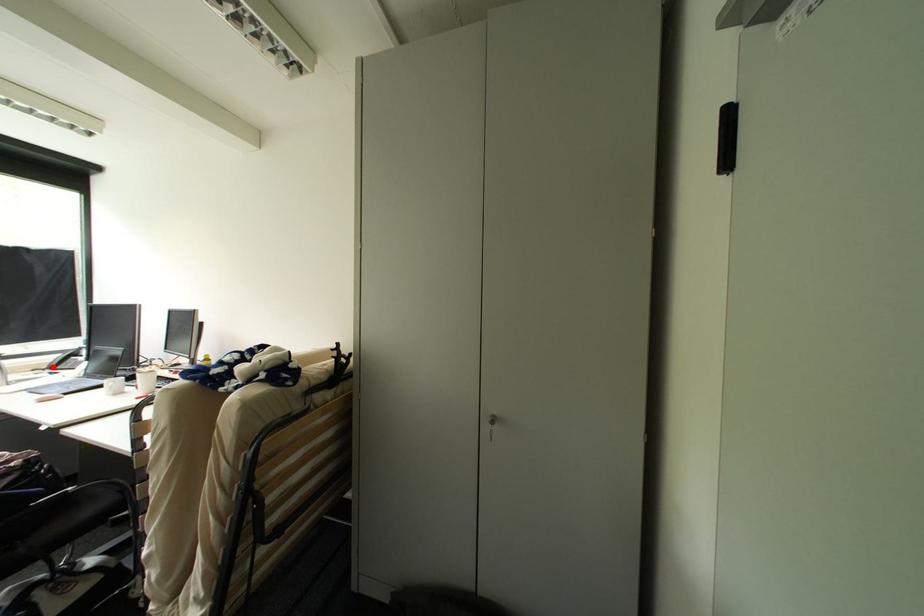
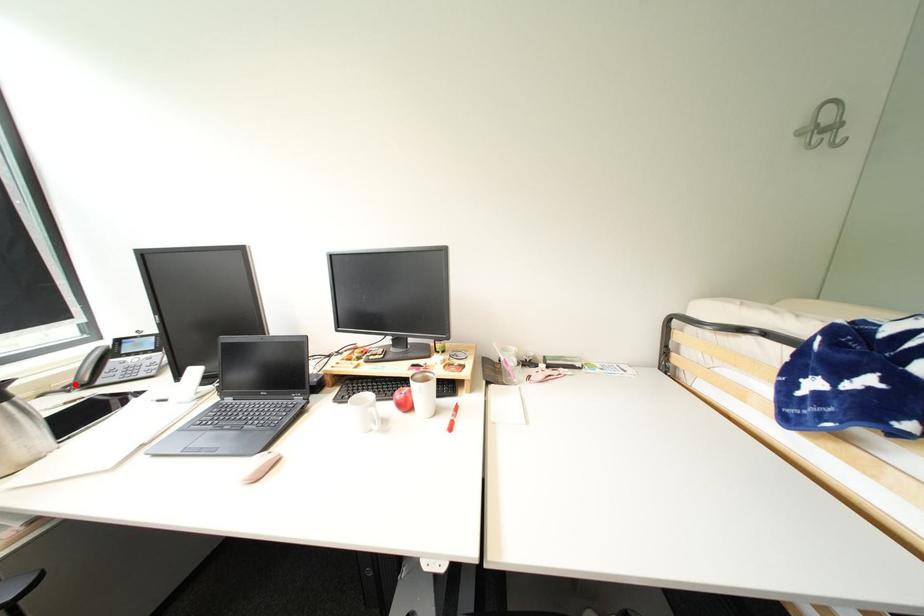
I am providing you with two images of the same scene from different viewpoints. A red point is marked on the first image and another point is marked on the second image. Is the red point in image1 aligned with the point shown in image2?

Yes